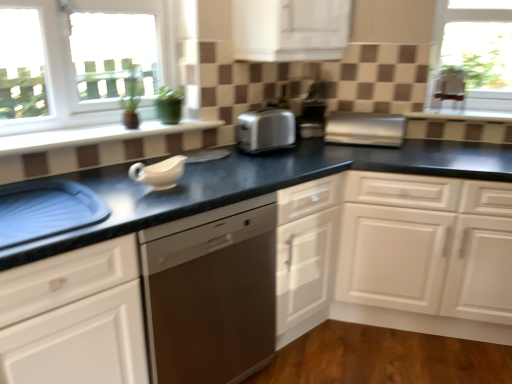
At what (x,y) coordinates should I click in order to perform the action: click on free point above satin silver toaster at center (from a real-world perspective). Please return your answer as a coordinate pair (x, y). The height and width of the screenshot is (384, 512). Looking at the image, I should click on (360, 119).